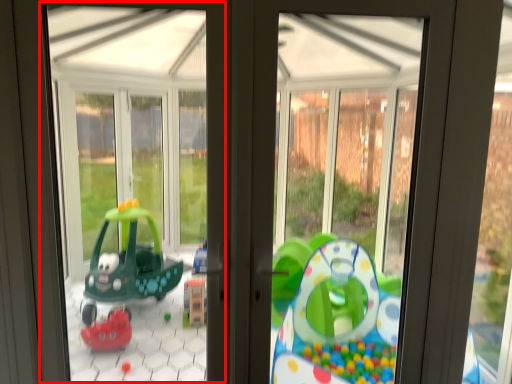
Question: From the image's perspective, what is the correct spatial relationship of bay window (annotated by the red box) in relation to window frame?

Choices:
 (A) below
 (B) above

Answer: (B)